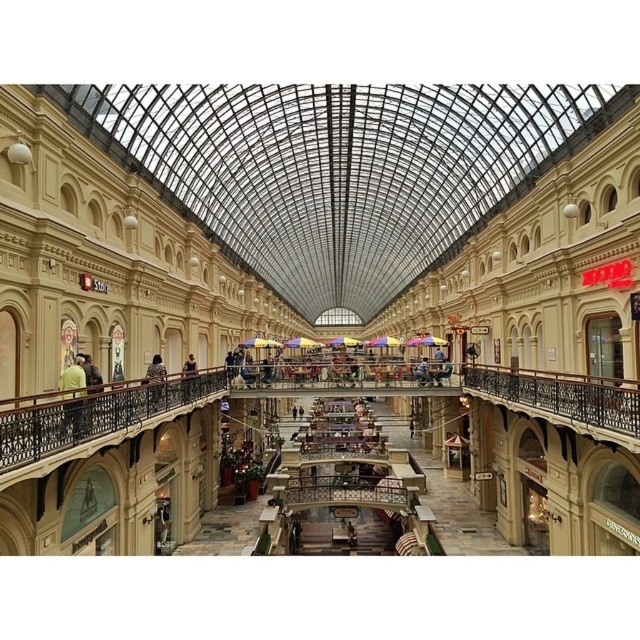
Does green fabric shirt at left appear over dark blue shirt at center?

Correct, green fabric shirt at left is located above dark blue shirt at center.

Looking at this image, between green fabric shirt at left and dark blue shirt at center, which one has more height?

green fabric shirt at left

Is point (72, 384) behind point (180, 385)?

No.

Image resolution: width=640 pixels, height=640 pixels. Identify the location of green fabric shirt at left. (74, 394).

Which of these two, beige stone mall at center or leopard print coat at center, stands taller?

With more height is beige stone mall at center.

Does point (80, 186) come closer to viewer compared to point (163, 392)?

Yes, it is in front of point (163, 392).

Is point (157, 259) less distant than point (156, 378)?

No.

This screenshot has height=640, width=640. I want to click on beige stone mall at center, so pos(330,288).

Who is more distant from viewer, (x=68, y=378) or (x=150, y=380)?

Point (x=150, y=380)

Where is `green fabric shirt at left`? green fabric shirt at left is located at coordinates (74, 394).

Locate an element on the screen. This screenshot has width=640, height=640. green fabric shirt at left is located at coordinates (74, 394).